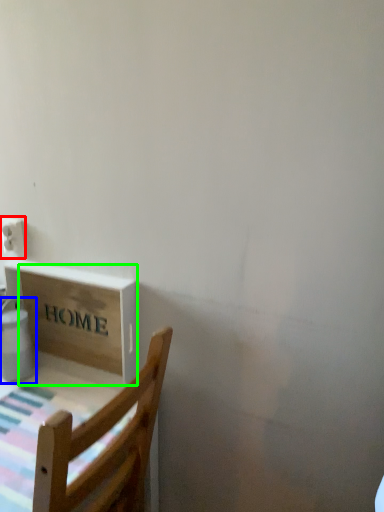
Question: Estimate the real-world distances between objects in this image. Which object is closer to electric outlet (highlighted by a red box), water heater (highlighted by a blue box) or cardboard box (highlighted by a green box)?

Choices:
 (A) water heater
 (B) cardboard box

Answer: (A)